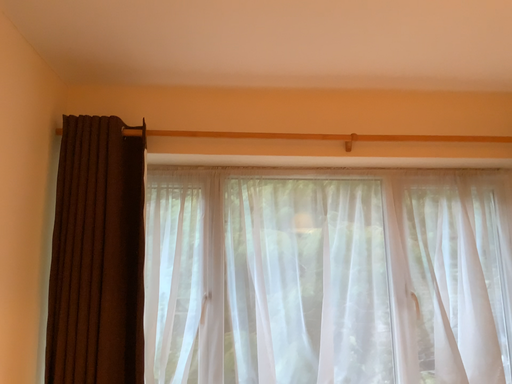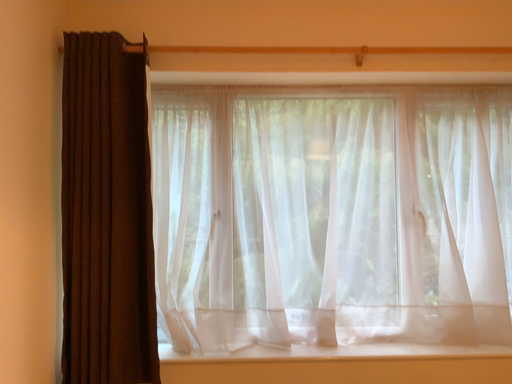
Question: How did the camera likely rotate when shooting the video?

Choices:
 (A) rotated upward
 (B) rotated downward

Answer: (B)